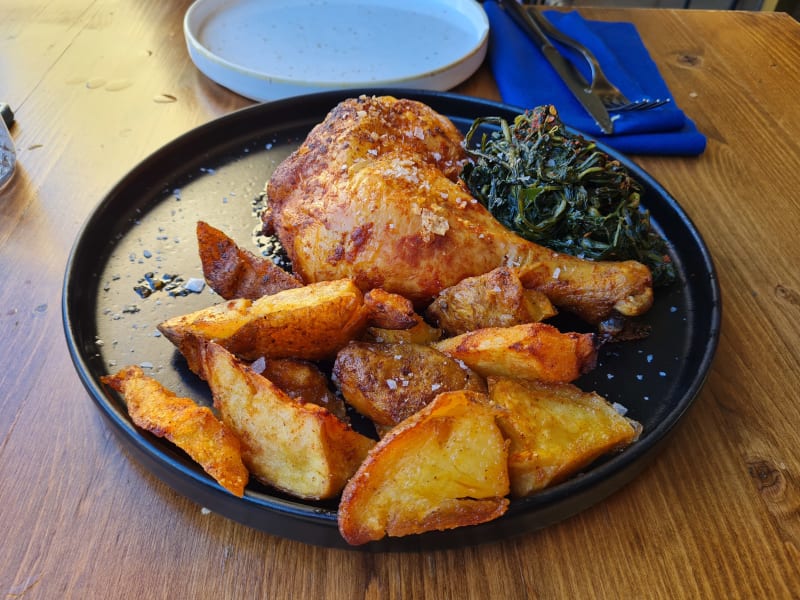
You are a GUI agent. You are given a task and a screenshot of the screen. Output one action in this format:
    pyautogui.click(x=<x>, y=<y>)
    Task: Click on the utensils
    The image size is (800, 600).
    Given the screenshot: What is the action you would take?
    pyautogui.click(x=606, y=88), pyautogui.click(x=586, y=98)